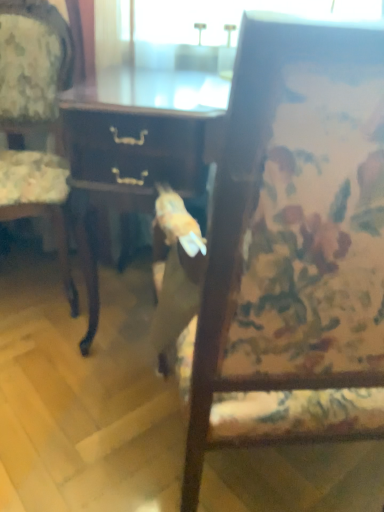
Image resolution: width=384 pixels, height=512 pixels. I want to click on vacant space in wooden chair at center, arranged as the first chair when viewed from the right (from a real-world perspective), so click(x=253, y=468).